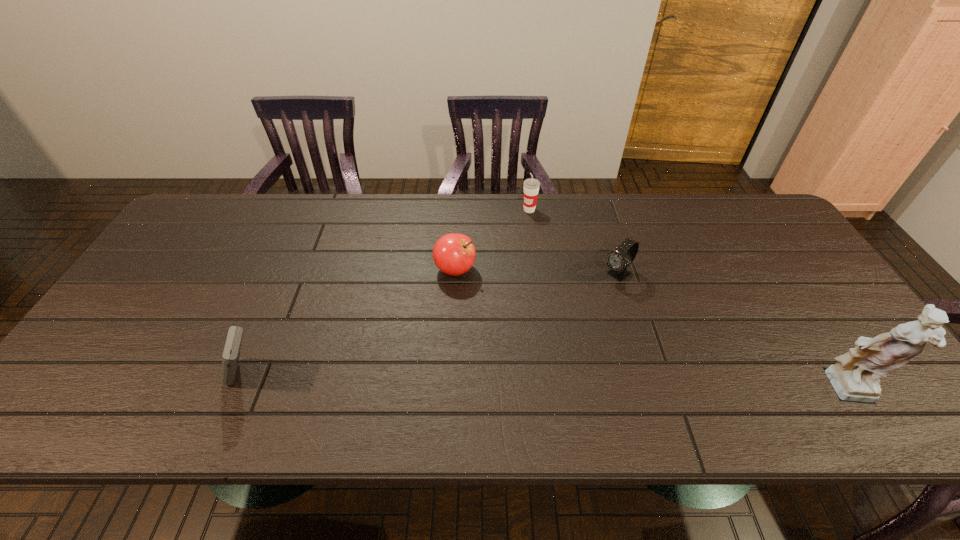
The width and height of the screenshot is (960, 540). In order to click on vacant space on the desktop that is between the leftmost object and the figurine and is positioned on the stem of the second object from left to right in this screenshot , I will do `click(573, 384)`.

Identify the location of vacant spot on the desktop that is between the leftmost object and the figurine and is positioned on the face of the watch. (482, 382).

I want to click on vacant space on the desktop that is between the leftmost object and the rightmost object and is positioned on the side of the third object from right to left with the logo, so click(462, 382).